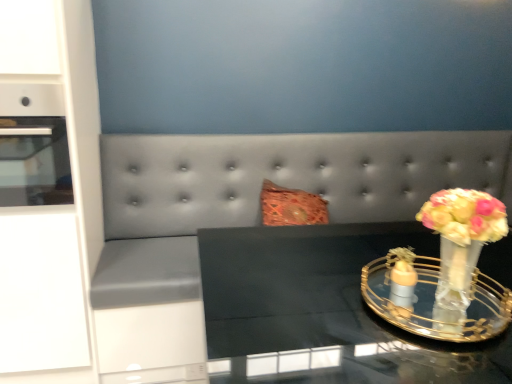
Identify the location of blank area to the left of matte orange glass candle holder at right, the 1th candle holder positioned from the left. This screenshot has height=384, width=512. (347, 300).